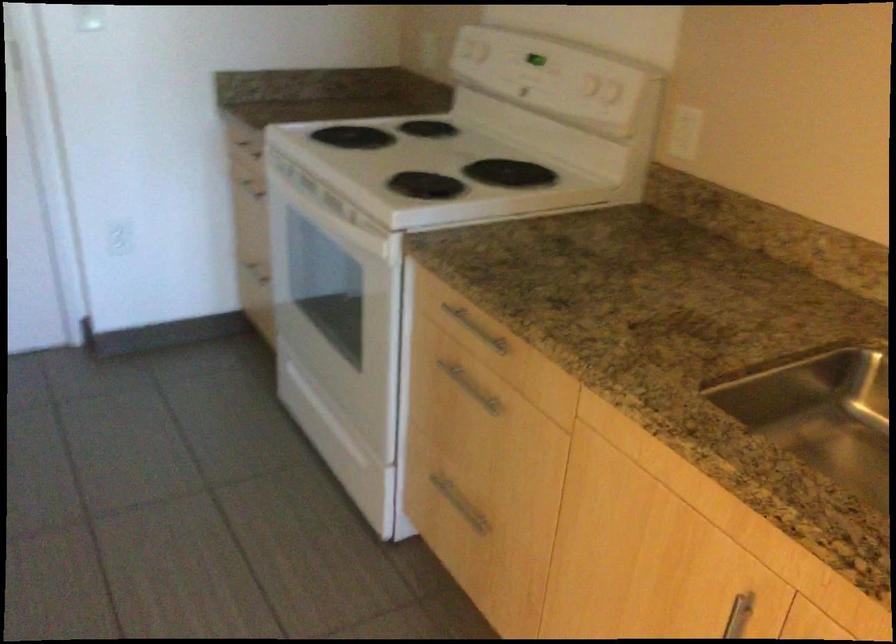
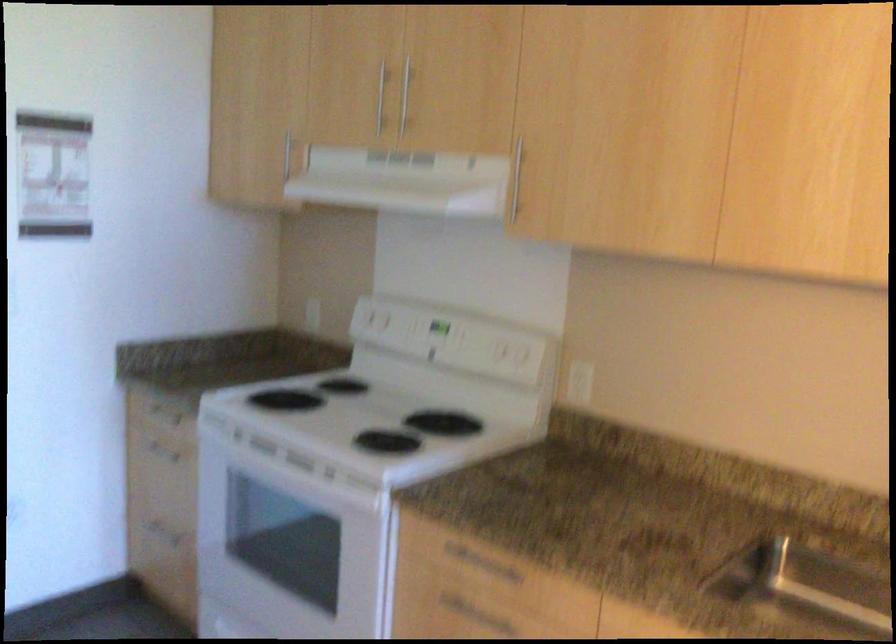
Locate, in the second image, the point that corresponds to (x=475, y=325) in the first image.

(480, 564)